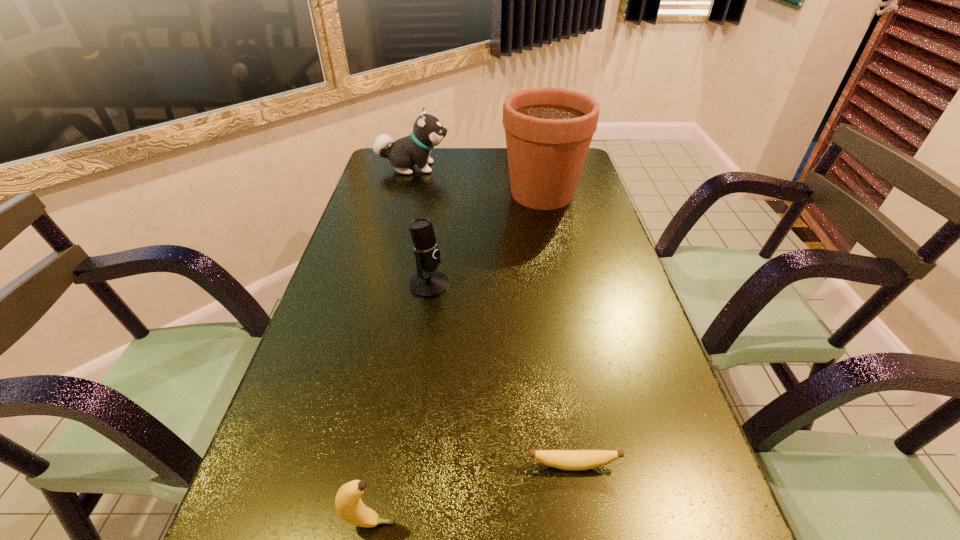
Find the location of a particular element. Image resolution: width=960 pixels, height=540 pixels. free space located from the stem of the nearer banana is located at coordinates (507, 523).

Find the location of a particular element. The width and height of the screenshot is (960, 540). blank space located 0.130m on the right of the farther banana is located at coordinates [698, 465].

Find the location of a particular element. The image size is (960, 540). flowerpot positioned at the far edge is located at coordinates (548, 131).

Identify the location of puppy that is positioned at the far edge. (428, 132).

The height and width of the screenshot is (540, 960). What are the coordinates of `object located in the left edge section of the desktop` in the screenshot? It's located at (428, 132).

Find the location of `flowerpot at the right edge`. flowerpot at the right edge is located at coordinates (548, 131).

You are a GUI agent. You are given a task and a screenshot of the screen. Output one action in this format:
    pyautogui.click(x=<x>, y=<y>)
    Task: Click on the banana that is at the right edge
    
    Given the screenshot: What is the action you would take?
    pyautogui.click(x=563, y=459)

Find the location of a particular element. The height and width of the screenshot is (540, 960). object that is at the far left corner is located at coordinates [428, 132].

Where is `object that is at the far right corner`? The image size is (960, 540). object that is at the far right corner is located at coordinates (548, 131).

In the image, there is a desktop. Where is `vacant space at the far edge`? This screenshot has height=540, width=960. vacant space at the far edge is located at coordinates (468, 172).